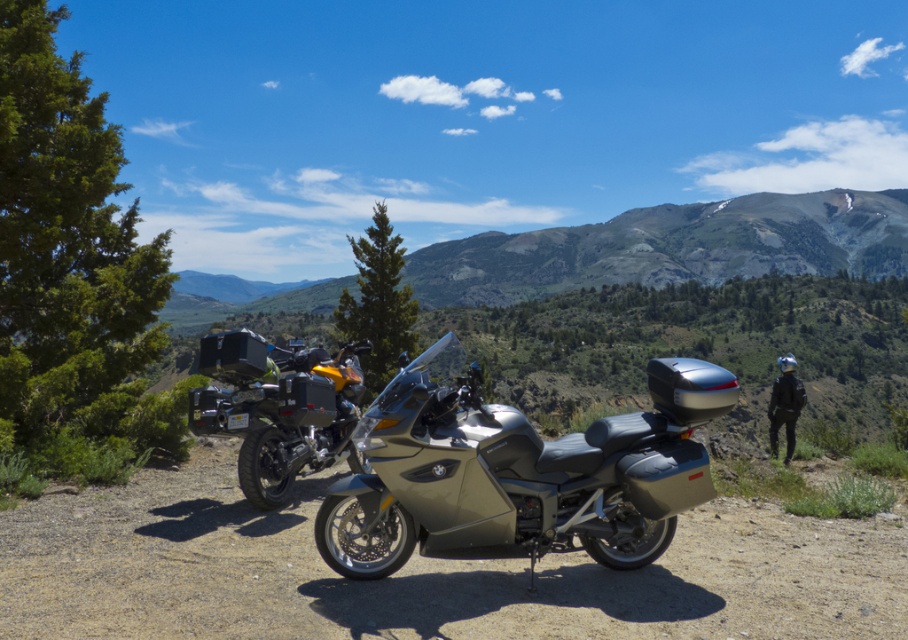
Does metallic silver motorcycle at center have a greater width compared to green textured mountain at upper center?

No, metallic silver motorcycle at center is not wider than green textured mountain at upper center.

Is metallic silver motorcycle at center shorter than green textured mountain at upper center?

Yes.

You are a GUI agent. You are given a task and a screenshot of the screen. Output one action in this format:
    pyautogui.click(x=<x>, y=<y>)
    Task: Click on the metallic silver motorcycle at center
    Image resolution: width=908 pixels, height=640 pixels.
    Given the screenshot: What is the action you would take?
    pyautogui.click(x=502, y=480)

Can you confirm if gray gravel dirt track at center is wider than green textured mountain at upper center?

In fact, gray gravel dirt track at center might be narrower than green textured mountain at upper center.

Who is shorter, gray gravel dirt track at center or green textured mountain at upper center?

With less height is gray gravel dirt track at center.

What do you see at coordinates (422, 572) in the screenshot? I see `gray gravel dirt track at center` at bounding box center [422, 572].

Where is `gray gravel dirt track at center`? The image size is (908, 640). gray gravel dirt track at center is located at coordinates (422, 572).

Who is more forward, [666,422] or [245,444]?

Point [666,422]

Is metallic silver motorcycle at center to the right of matte black motorcycle at center from the viewer's perspective?

Yes, metallic silver motorcycle at center is to the right of matte black motorcycle at center.

Find the location of `metallic silver motorcycle at center`. metallic silver motorcycle at center is located at coordinates (502, 480).

This screenshot has height=640, width=908. What are the coordinates of `metallic silver motorcycle at center` in the screenshot? It's located at (502, 480).